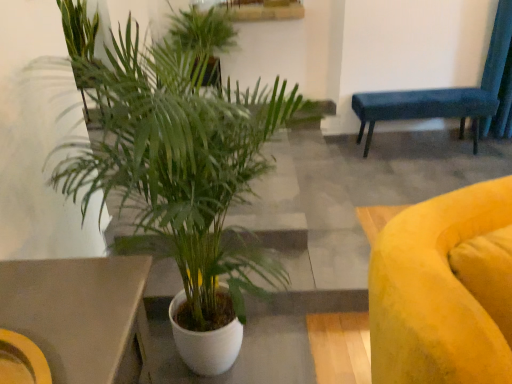
Question: From the image's perspective, is velvet blue bench at upper right above white ceramic plant at center, positioned as the first houseplant in bottom-to-top order?

Choices:
 (A) no
 (B) yes

Answer: (B)

Question: Does velvet blue bench at upper right have a smaller size compared to white ceramic plant at center, acting as the 2th houseplant starting from the top?

Choices:
 (A) no
 (B) yes

Answer: (B)

Question: Considering the relative sizes of velvet blue bench at upper right and white ceramic plant at center, positioned as the first houseplant in bottom-to-top order, in the image provided, is velvet blue bench at upper right shorter than white ceramic plant at center, positioned as the first houseplant in bottom-to-top order,?

Choices:
 (A) no
 (B) yes

Answer: (B)

Question: Considering the relative sizes of velvet blue bench at upper right and white ceramic plant at center, acting as the 2th houseplant starting from the top, in the image provided, is velvet blue bench at upper right bigger than white ceramic plant at center, acting as the 2th houseplant starting from the top,?

Choices:
 (A) no
 (B) yes

Answer: (A)

Question: Is velvet blue bench at upper right further to the viewer compared to white ceramic plant at center, positioned as the first houseplant in bottom-to-top order?

Choices:
 (A) yes
 (B) no

Answer: (A)

Question: From the image's perspective, is velvet blue bench at upper right positioned above or below white ceramic plant at center, the second houseplant from the back?

Choices:
 (A) above
 (B) below

Answer: (A)

Question: Do you think velvet blue bench at upper right is within white ceramic plant at center, acting as the 2th houseplant starting from the top, or outside of it?

Choices:
 (A) inside
 (B) outside

Answer: (B)

Question: From a real-world perspective, is velvet blue bench at upper right positioned above or below white ceramic plant at center, acting as the 2th houseplant starting from the top?

Choices:
 (A) below
 (B) above

Answer: (A)

Question: In the image, is velvet blue bench at upper right positioned in front of or behind white ceramic plant at center, acting as the 2th houseplant starting from the top?

Choices:
 (A) front
 (B) behind

Answer: (B)

Question: In the image, is white ceramic plant at center, placed as the 1th houseplant when sorted from front to back, positioned in front of or behind velvet blue bench at upper right?

Choices:
 (A) front
 (B) behind

Answer: (A)

Question: From a real-world perspective, is white ceramic plant at center, placed as the 1th houseplant when sorted from front to back, positioned above or below velvet blue bench at upper right?

Choices:
 (A) below
 (B) above

Answer: (B)

Question: From their relative heights in the image, would you say white ceramic plant at center, the second houseplant from the back, is taller or shorter than velvet blue bench at upper right?

Choices:
 (A) tall
 (B) short

Answer: (A)

Question: Choose the correct answer: Is white ceramic plant at center, the second houseplant from the back, inside velvet blue bench at upper right or outside it?

Choices:
 (A) outside
 (B) inside

Answer: (A)

Question: From their relative heights in the image, would you say velvet blue bench at upper right is taller or shorter than green leafy plant at upper center, which is the 1th houseplant from top to bottom?

Choices:
 (A) tall
 (B) short

Answer: (B)

Question: Is point (433, 112) closer or farther from the camera than point (206, 14)?

Choices:
 (A) closer
 (B) farther

Answer: (B)